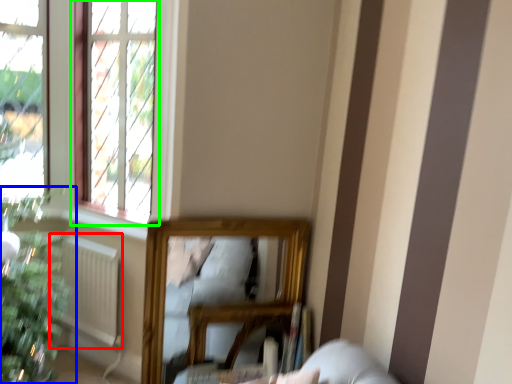
Question: Considering the real-world distances, which object is farthest from radiator (highlighted by a red box)? houseplant (highlighted by a blue box) or window (highlighted by a green box)?

Choices:
 (A) houseplant
 (B) window

Answer: (B)